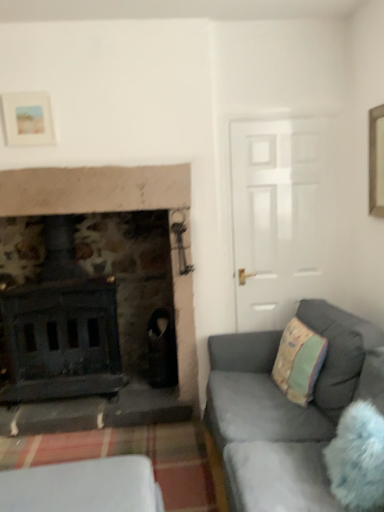
The height and width of the screenshot is (512, 384). I want to click on blank space situated above white plastic container at lower left (from a real-world perspective), so click(75, 484).